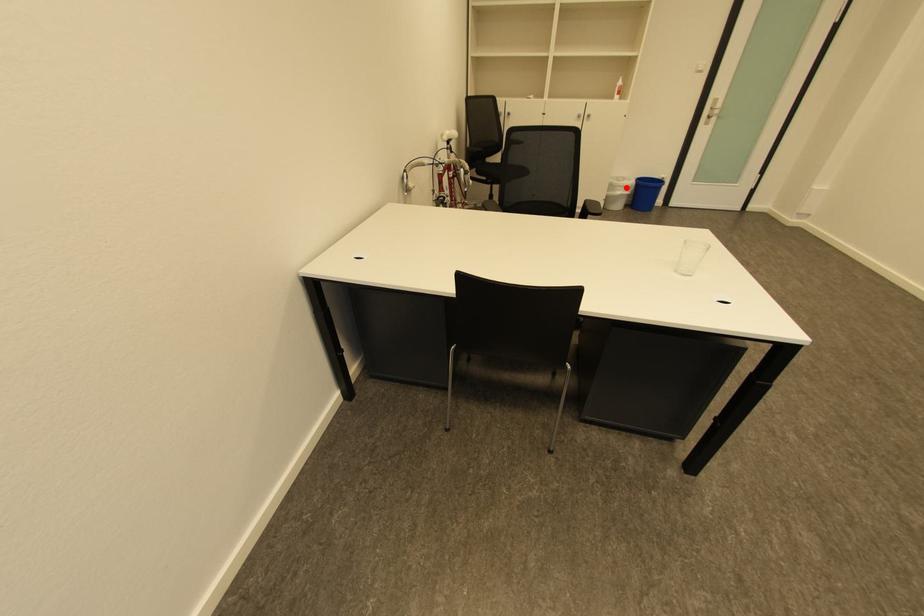
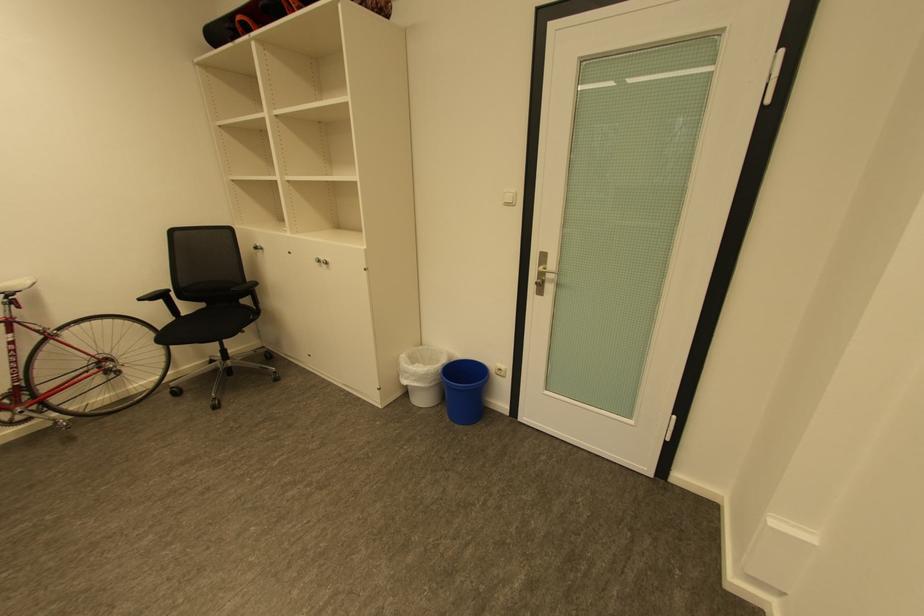
Question: I am providing you with two images of the same scene from different viewpoints. Given a red point in image1, look at the same physical point in image2. Is it:

Choices:
 (A) Closer to the viewpoint
 (B) Farther from the viewpoint

Answer: (B)